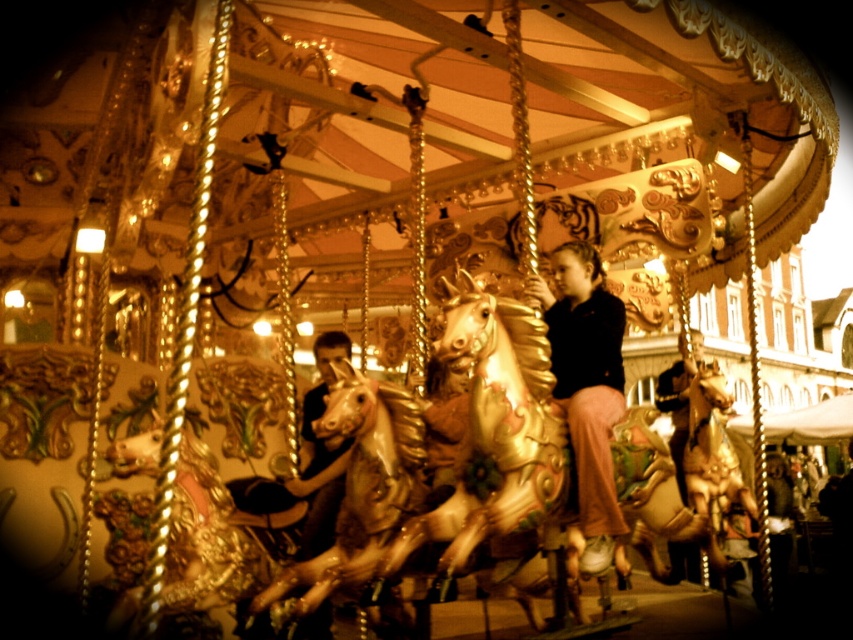
Question: Can you confirm if matte black jacket at center is bigger than matte black shirt at center?

Choices:
 (A) no
 (B) yes

Answer: (A)

Question: Which point is farther from the camera taking this photo?

Choices:
 (A) (555, 269)
 (B) (335, 515)

Answer: (A)

Question: Which point is closer to the camera?

Choices:
 (A) (608, 301)
 (B) (331, 333)

Answer: (A)

Question: Is matte black jacket at center to the right of matte black shirt at center from the viewer's perspective?

Choices:
 (A) yes
 (B) no

Answer: (A)

Question: Is matte black jacket at center wider than matte black shirt at center?

Choices:
 (A) yes
 (B) no

Answer: (B)